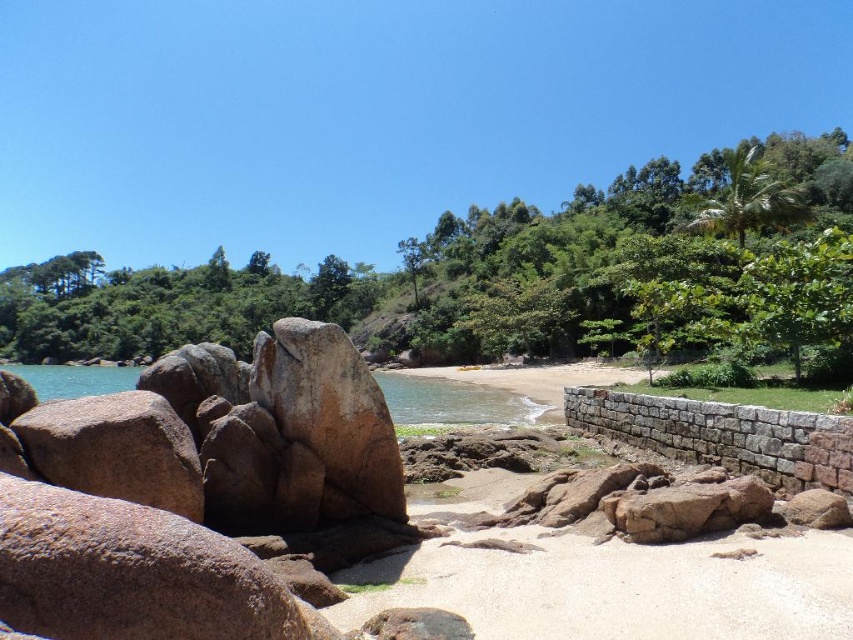
You are standing at the edge of the beach looking out at the water. There is a point marked on the map at coordinates (616, 584). What is located at that point?

The point at coordinates (616, 584) marks light brown sand at center.